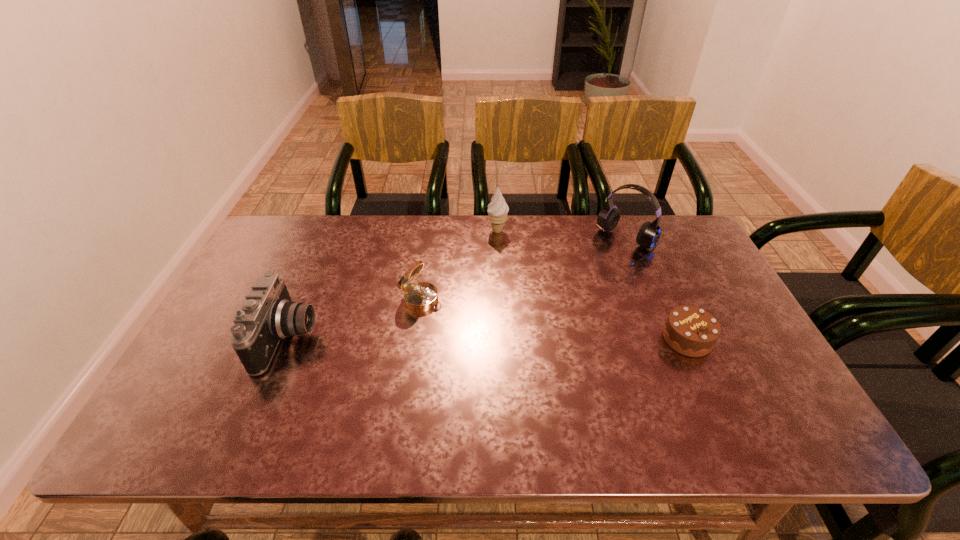
In order to click on camera in this screenshot , I will do `click(267, 315)`.

The height and width of the screenshot is (540, 960). I want to click on chocolate cake, so click(x=691, y=331).

The width and height of the screenshot is (960, 540). In order to click on the fourth object from right to left in this screenshot , I will do `click(421, 296)`.

Find the location of a particular element. compass is located at coordinates (421, 296).

Find the location of a particular element. icecream is located at coordinates (497, 211).

The width and height of the screenshot is (960, 540). Find the location of `headset`. headset is located at coordinates (648, 236).

Identify the location of free space located 0.050m on the front-facing side of the camera. (334, 338).

The height and width of the screenshot is (540, 960). I want to click on free space located on the left of the chocolate cake, so click(x=535, y=339).

I want to click on free space located with the dial facing the second object from left to right, so click(x=492, y=333).

Where is `free space located 0.050m with the dial facing the second object from left to right`? The height and width of the screenshot is (540, 960). free space located 0.050m with the dial facing the second object from left to right is located at coordinates pos(452,313).